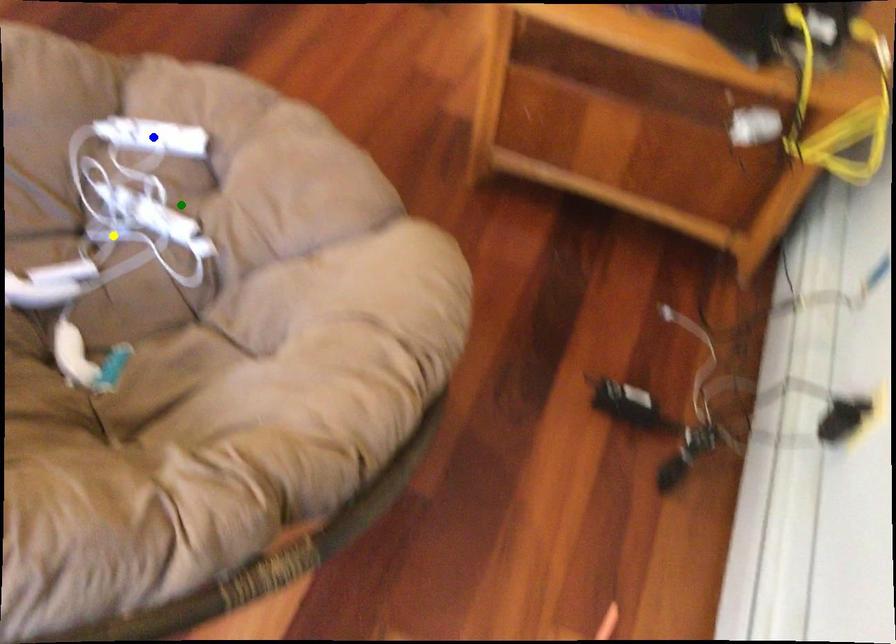
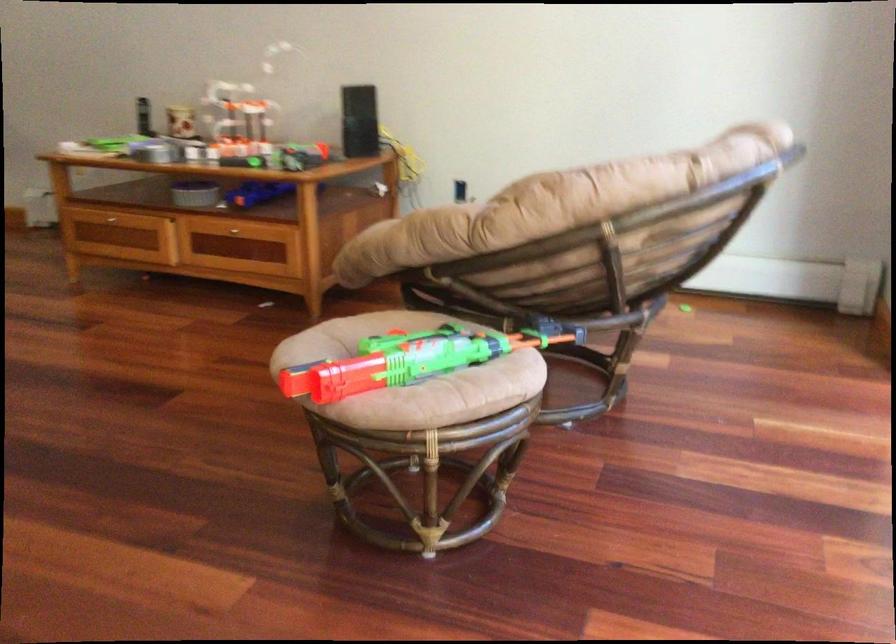
I am providing you with two images of the same scene from different viewpoints. Three points are marked in image1. Which point corresponds to a part or object that is occluded in image2?In image1, three points are marked. Which of them correspond to a part or object that is occluded in image2?Among the three points shown in image1, which one corresponds to a part or object that is no longer visible due to occlusion in image2?

green point, yellow point, blue point cannot be seen in image2.